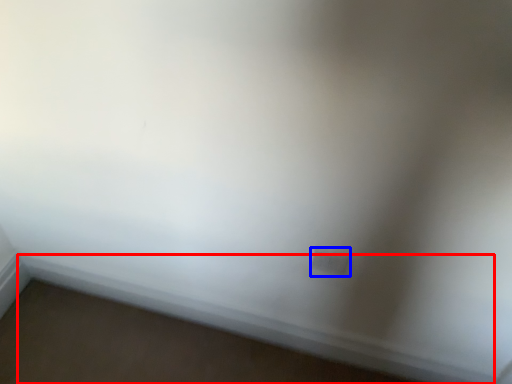
Question: Among these objects, which one is farthest to the camera, window sill (highlighted by a red box) or electric outlet (highlighted by a blue box)?

Choices:
 (A) window sill
 (B) electric outlet

Answer: (A)